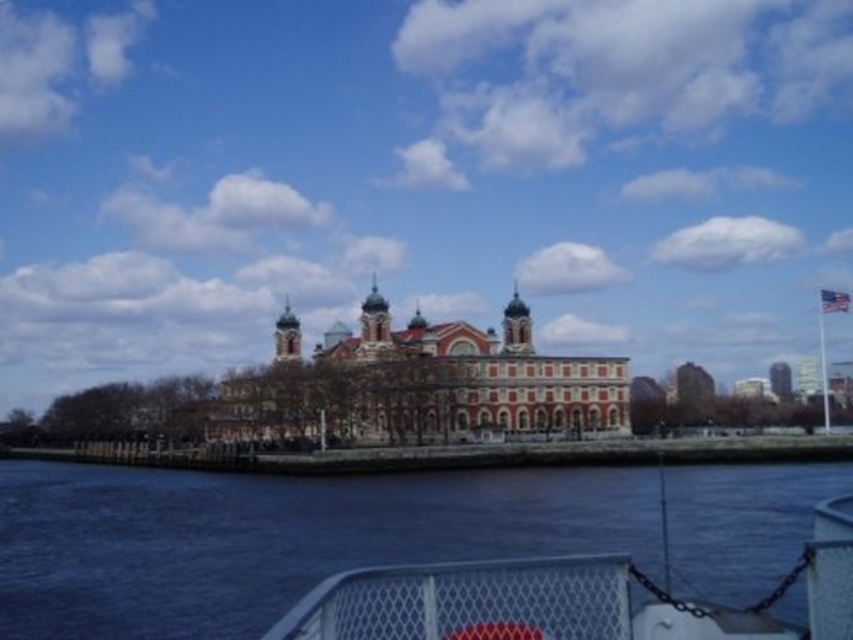
You are standing on the deck of the boat and want to walk from the point marked as point (x=572, y=488) to the point marked as point (x=598, y=372). Which direction should you move to reach your destination?

You should move backward to reach point (x=598, y=372) because point (x=572, y=488) is in front of it.